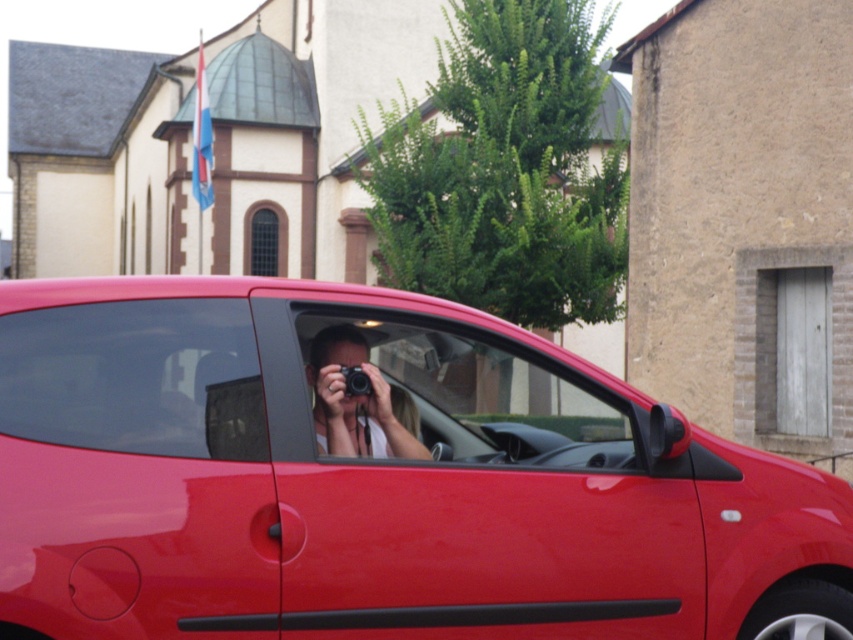
Between point (355, 499) and point (194, 346), which one is positioned in front?

Point (355, 499)

Based on the photo, can you confirm if glossy red car at center is positioned to the left of transparent glass window at center?

Incorrect, glossy red car at center is not on the left side of transparent glass window at center.

The height and width of the screenshot is (640, 853). What do you see at coordinates (374, 477) in the screenshot? I see `glossy red car at center` at bounding box center [374, 477].

Locate an element on the screen. This screenshot has width=853, height=640. glossy red car at center is located at coordinates (374, 477).

Does glossy red car at center come behind transparent glass at center?

No, glossy red car at center is in front of transparent glass at center.

Is glossy red car at center wider than transparent glass at center?

Correct, the width of glossy red car at center exceeds that of transparent glass at center.

Find the location of a particular element. glossy red car at center is located at coordinates (374, 477).

Does transparent glass at center have a lesser height compared to matte black camera at center?

In fact, transparent glass at center may be taller than matte black camera at center.

Between transparent glass at center and matte black camera at center, which one is positioned lower?

transparent glass at center

Image resolution: width=853 pixels, height=640 pixels. Find the location of `transparent glass at center`. transparent glass at center is located at coordinates [x=450, y=397].